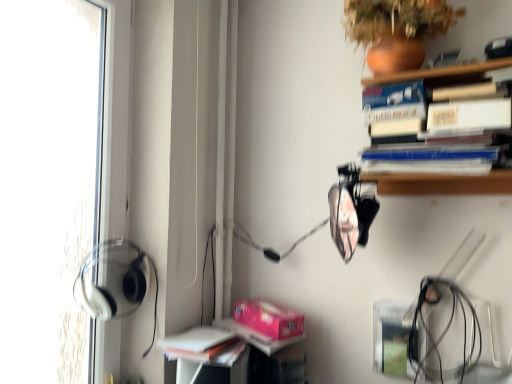
Question: Should I look upward or downward to see white matte book at lower left?

Choices:
 (A) up
 (B) down

Answer: (B)

Question: Can you see white matte book at lower left touching terracotta clay vase at upper right?

Choices:
 (A) no
 (B) yes

Answer: (A)

Question: Is white matte book at lower left far away from terracotta clay vase at upper right?

Choices:
 (A) no
 (B) yes

Answer: (B)

Question: Considering the relative sizes of white matte book at lower left and terracotta clay vase at upper right in the image provided, is white matte book at lower left smaller than terracotta clay vase at upper right?

Choices:
 (A) yes
 (B) no

Answer: (A)

Question: Considering the relative sizes of white matte book at lower left and terracotta clay vase at upper right in the image provided, is white matte book at lower left taller than terracotta clay vase at upper right?

Choices:
 (A) no
 (B) yes

Answer: (A)

Question: Can you confirm if white matte book at lower left is thinner than terracotta clay vase at upper right?

Choices:
 (A) yes
 (B) no

Answer: (A)

Question: Is terracotta clay vase at upper right located within white matte book at lower left?

Choices:
 (A) no
 (B) yes

Answer: (A)

Question: Is terracotta clay vase at upper right positioned with its back to white matte book at lower left?

Choices:
 (A) no
 (B) yes

Answer: (A)

Question: Does terracotta clay vase at upper right have a greater width compared to white matte book at lower left?

Choices:
 (A) no
 (B) yes

Answer: (B)

Question: Considering the relative sizes of terracotta clay vase at upper right and white matte book at lower left in the image provided, is terracotta clay vase at upper right taller than white matte book at lower left?

Choices:
 (A) no
 (B) yes

Answer: (B)

Question: Would you say terracotta clay vase at upper right is outside white matte book at lower left?

Choices:
 (A) yes
 (B) no

Answer: (A)

Question: From a real-world perspective, is terracotta clay vase at upper right physically below white matte book at lower left?

Choices:
 (A) no
 (B) yes

Answer: (A)

Question: From a real-world perspective, is terracotta clay vase at upper right on top of white matte book at lower left?

Choices:
 (A) yes
 (B) no

Answer: (A)

Question: Is pink matte paperback book at lower center positioned behind white matte book at lower left?

Choices:
 (A) yes
 (B) no

Answer: (A)